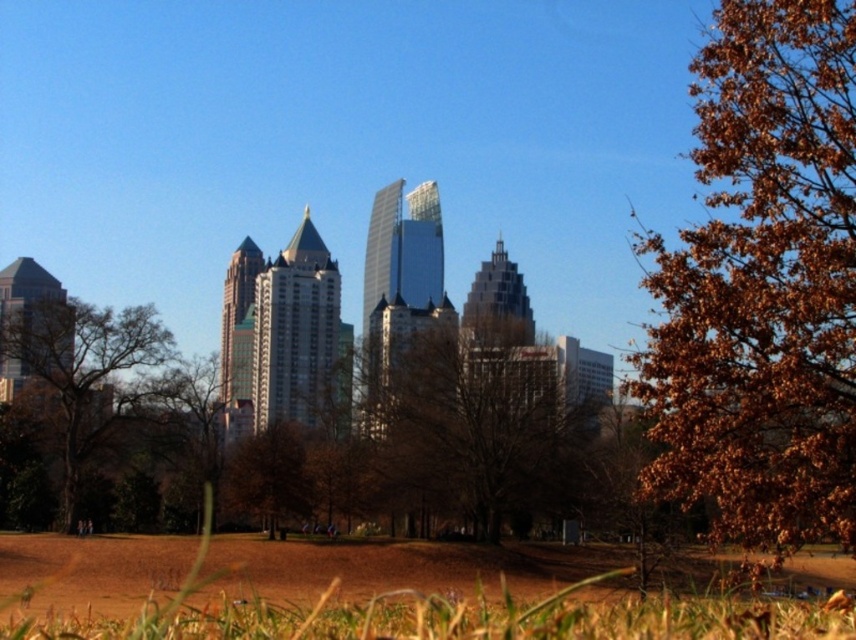
Question: Does brown leafy tree at left have a greater width compared to brown matte tree at center?

Choices:
 (A) no
 (B) yes

Answer: (B)

Question: Does brown dry grass at lower center appear over brown matte tree at center?

Choices:
 (A) yes
 (B) no

Answer: (B)

Question: Which point is farther to the camera?

Choices:
 (A) (777, 280)
 (B) (296, 452)

Answer: (B)

Question: Does brown leafy tree at right appear under brown leafy tree at left?

Choices:
 (A) yes
 (B) no

Answer: (B)

Question: Which of the following is the farthest from the observer?

Choices:
 (A) (52, 332)
 (B) (587, 385)

Answer: (A)

Question: Which of the following is the farthest from the observer?

Choices:
 (A) brown matte tree at center
 (B) brown leafy tree at center
 (C) brown dry grass at lower center
 (D) brown leafy tree at right

Answer: (A)